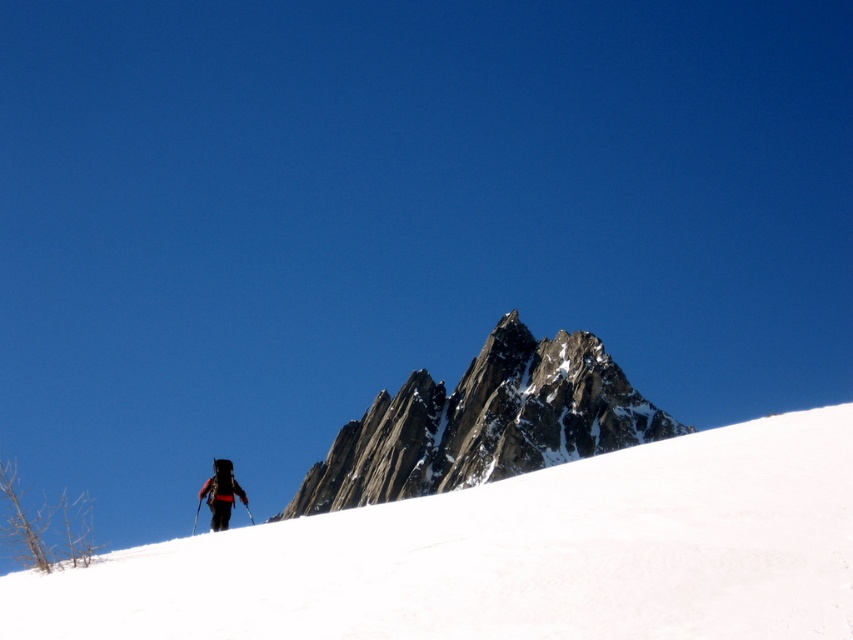
Question: Which is farther from the rocky gray mountain peak at center?

Choices:
 (A) black fabric backpack at lower center
 (B) white snow at center

Answer: (B)

Question: Can you confirm if rocky gray mountain peak at center is positioned to the right of black fabric backpack at lower center?

Choices:
 (A) yes
 (B) no

Answer: (A)

Question: Among these points, which one is farthest from the camera?

Choices:
 (A) (361, 465)
 (B) (697, 516)
 (C) (222, 515)

Answer: (A)

Question: Which point is closer to the camera taking this photo?

Choices:
 (A) (372, 484)
 (B) (610, 572)
 (C) (222, 509)

Answer: (B)

Question: Does white snow at center appear over rocky gray mountain peak at center?

Choices:
 (A) no
 (B) yes

Answer: (B)

Question: Can you confirm if white snow at center is smaller than black fabric backpack at lower center?

Choices:
 (A) yes
 (B) no

Answer: (B)